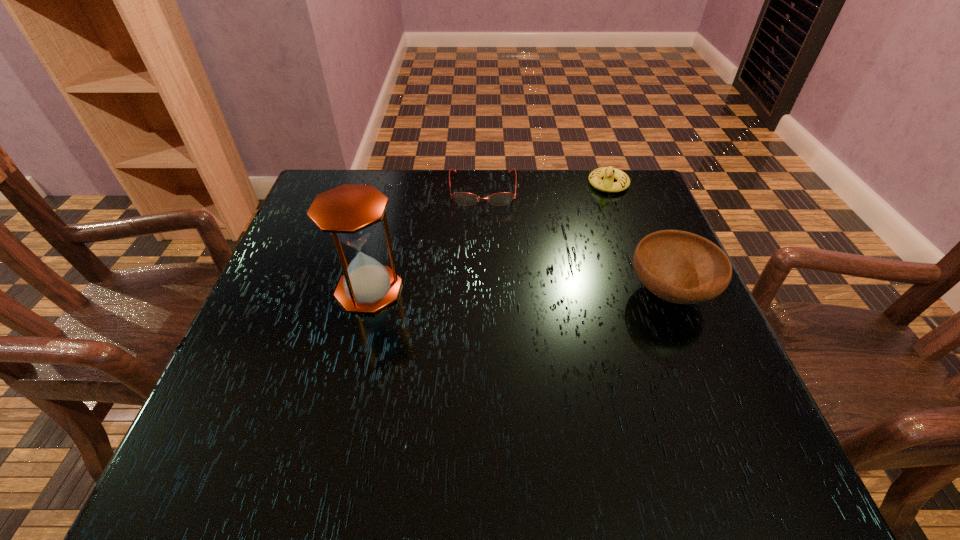
At what (x,y) coordinates should I click in order to perform the action: click on free spot on the desktop that is between the leftmost object and the third shortest object and is positioned on the face of the duckling. Please return your answer as a coordinate pair (x, y). Looking at the image, I should click on (554, 291).

Locate an element on the screen. This screenshot has height=540, width=960. free space on the desktop that is between the tallest object and the third shortest object and is positioned on the lenses of the third object from right to left is located at coordinates [485, 291].